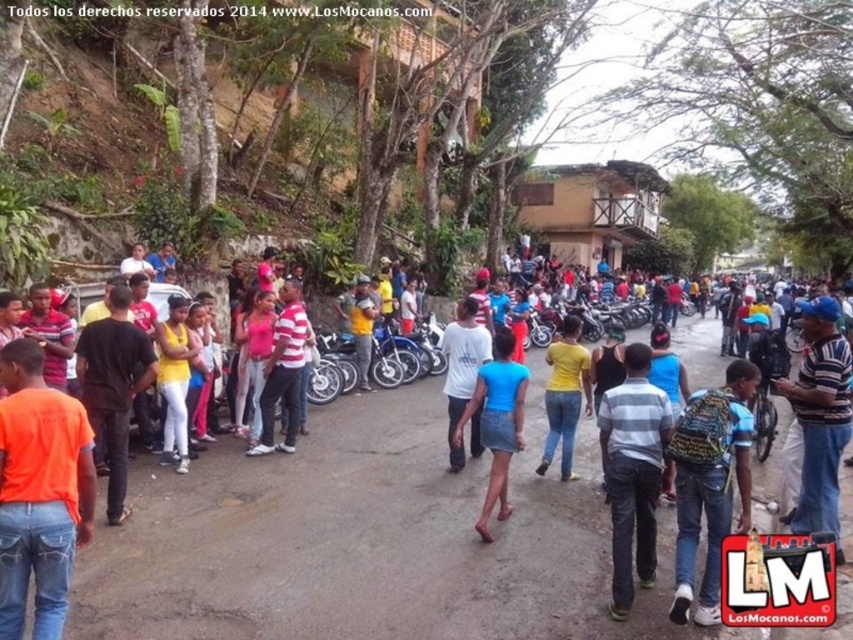
From the picture: Is yellow backpack at center to the left of white cotton shirt at center from the viewer's perspective?

No, yellow backpack at center is not to the left of white cotton shirt at center.

Locate an element on the screen. The image size is (853, 640). yellow backpack at center is located at coordinates (711, 483).

What do you see at coordinates (711, 483) in the screenshot? The image size is (853, 640). I see `yellow backpack at center` at bounding box center [711, 483].

Locate an element on the screen. yellow backpack at center is located at coordinates (711, 483).

Does orange matte shirt at lower left have a larger size compared to yellow backpack at center?

No, orange matte shirt at lower left is not bigger than yellow backpack at center.

Which is above, orange matte shirt at lower left or yellow backpack at center?

Positioned higher is orange matte shirt at lower left.

This screenshot has width=853, height=640. What are the coordinates of `orange matte shirt at lower left` in the screenshot? It's located at pos(39,492).

Image resolution: width=853 pixels, height=640 pixels. What are the coordinates of `orange matte shirt at lower left` in the screenshot? It's located at (39, 492).

Is the position of matte black shirt at center more distant than that of matte pink shirt at center?

No, it is in front of matte pink shirt at center.

What do you see at coordinates (366, 540) in the screenshot? This screenshot has width=853, height=640. I see `matte black shirt at center` at bounding box center [366, 540].

Locate an element on the screen. matte black shirt at center is located at coordinates (366, 540).